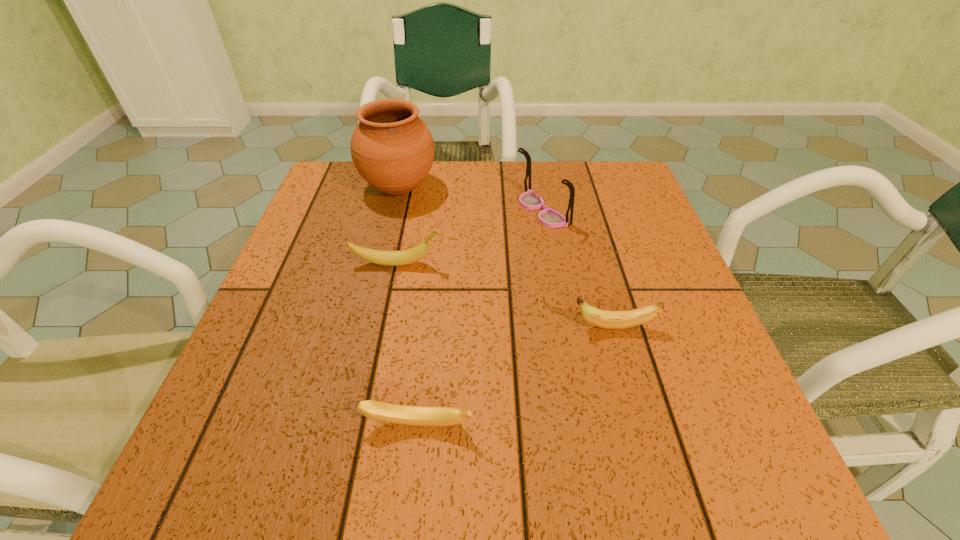
Find the location of a particular element. This screenshot has height=540, width=960. vacant space in between the third nearest object and the spectacles is located at coordinates (468, 237).

Identify the location of free space that is in between the spectacles and the second shortest object. The height and width of the screenshot is (540, 960). click(x=577, y=269).

Find the location of `empty space between the second nearest object and the shortest banana`. empty space between the second nearest object and the shortest banana is located at coordinates (516, 376).

The width and height of the screenshot is (960, 540). Identify the location of free space that is in between the second tallest object and the shortest banana. click(x=480, y=318).

I want to click on vacant area between the spectacles and the tallest object, so click(x=470, y=199).

At what (x,y) coordinates should I click in order to perform the action: click on free space between the rightmost banana and the spectacles. Please return your answer as a coordinate pair (x, y). Looking at the image, I should click on (577, 269).

At what (x,y) coordinates should I click in order to perform the action: click on free space between the shortest object and the rightmost banana. Please return your answer as a coordinate pair (x, y). The height and width of the screenshot is (540, 960). Looking at the image, I should click on (516, 376).

The width and height of the screenshot is (960, 540). In order to click on free point between the tallest object and the nearest banana in this screenshot , I will do `click(408, 306)`.

Find the location of a particular element. This screenshot has width=960, height=540. object that is the closest to the second tallest banana is located at coordinates (400, 414).

Where is `object that is the closest to the farthest banana`? The image size is (960, 540). object that is the closest to the farthest banana is located at coordinates (392, 149).